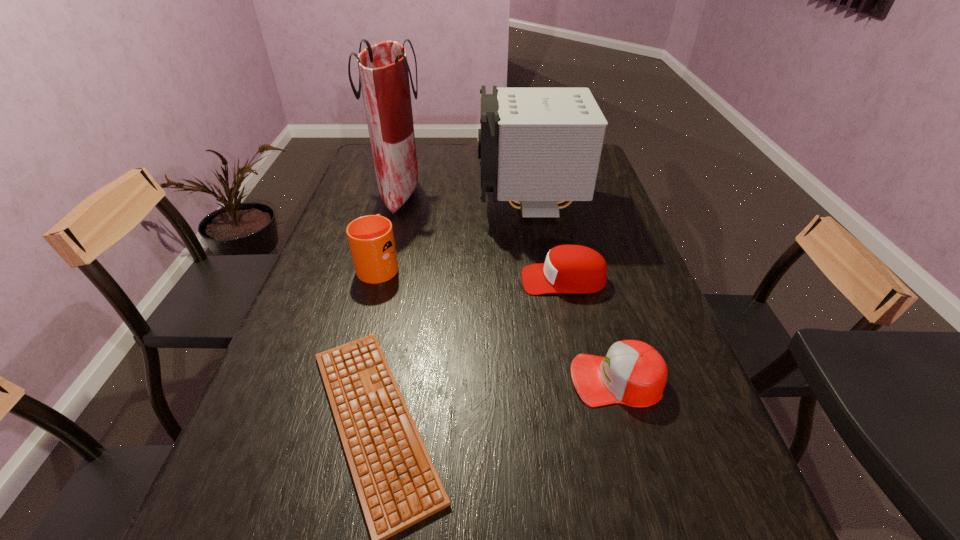
Find the location of a particular element. The image size is (960, 540). the closest object to the computer keyboard is located at coordinates (371, 239).

At what (x,y) coordinates should I click in order to perform the action: click on vacant space that satisfies the following two spatial constraints: 1. on the handle side of the mug; 2. on the left side of the grocery bag. Please return your answer as a coordinate pair (x, y). This screenshot has width=960, height=540. Looking at the image, I should click on (398, 192).

I want to click on free space in the image that satisfies the following two spatial constraints: 1. on the handle side of the second tallest object; 2. on the right side of the mug, so click(x=395, y=207).

At what (x,y) coordinates should I click in order to perform the action: click on vacant space that satisfies the following two spatial constraints: 1. on the handle side of the mug; 2. on the right side of the grocery bag. Please return your answer as a coordinate pair (x, y). The width and height of the screenshot is (960, 540). Looking at the image, I should click on (398, 192).